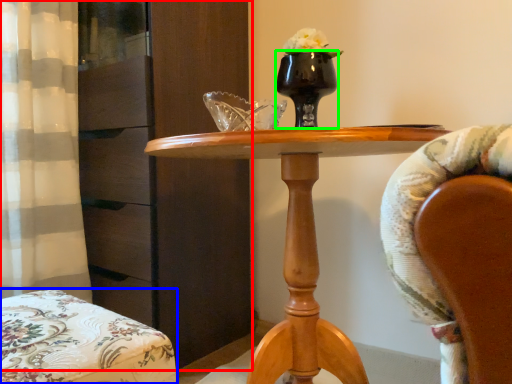
Question: Which is nearer to the dresser (highlighted by a red box)? chair (highlighted by a blue box) or vase (highlighted by a green box).

Choices:
 (A) chair
 (B) vase

Answer: (B)